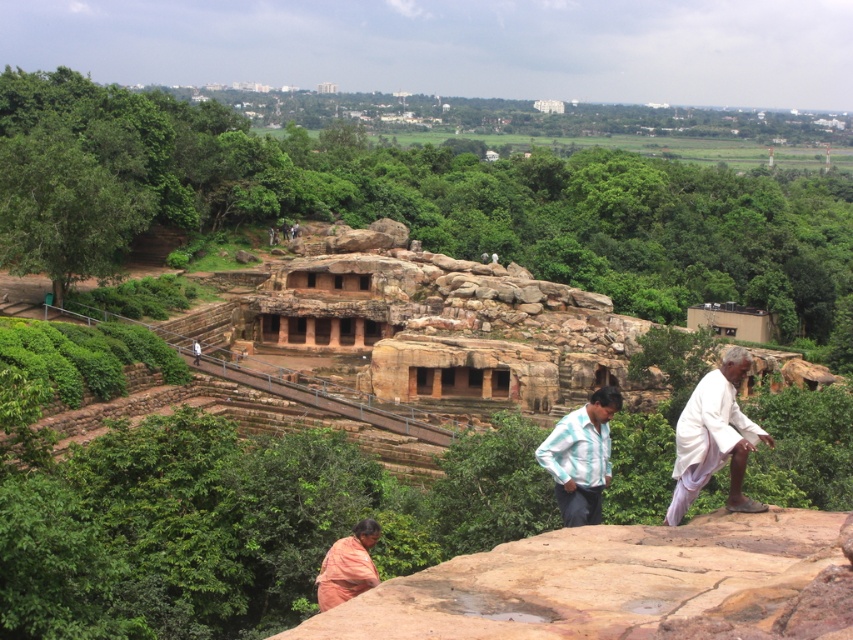
Question: Among these objects, which one is farthest from the camera?

Choices:
 (A) white cotton shirt at right
 (B) striped cotton shirt at center

Answer: (B)

Question: Can you confirm if white cotton shirt at right is bigger than striped cotton shirt at center?

Choices:
 (A) yes
 (B) no

Answer: (B)

Question: Can you confirm if white cotton shirt at right is wider than orange cotton sari at lower center?

Choices:
 (A) no
 (B) yes

Answer: (B)

Question: Which object is farther from the camera taking this photo?

Choices:
 (A) striped cotton shirt at center
 (B) orange cotton sari at lower center

Answer: (A)

Question: Which is nearer to the orange cotton sari at lower center?

Choices:
 (A) white cotton shirt at right
 (B) striped cotton shirt at center

Answer: (B)

Question: Does white cotton shirt at right appear on the left side of striped cotton shirt at center?

Choices:
 (A) yes
 (B) no

Answer: (B)